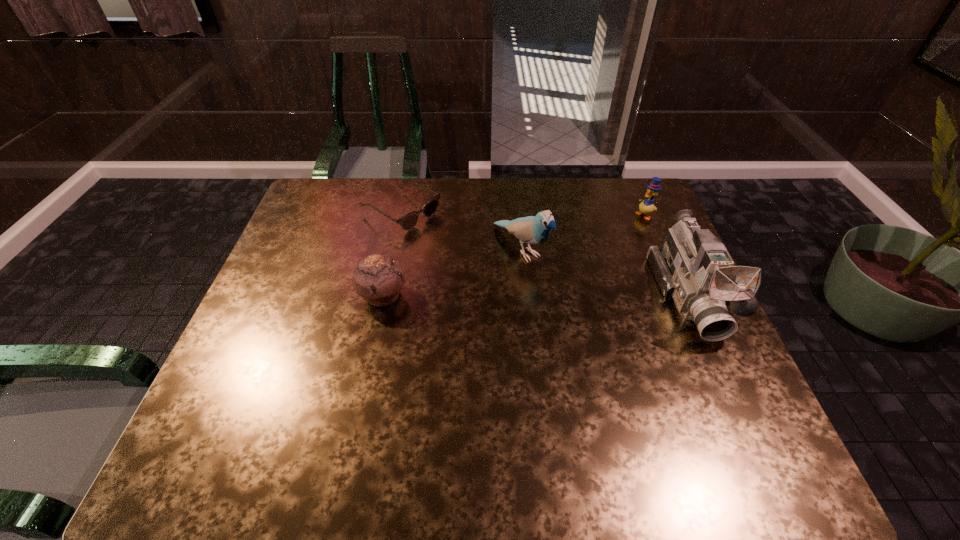
Identify the location of object present at the far right corner. (646, 206).

Image resolution: width=960 pixels, height=540 pixels. I want to click on free region at the far edge of the desktop, so click(417, 208).

Identify the location of vacant area at the near edge of the desktop. Image resolution: width=960 pixels, height=540 pixels. (318, 403).

Where is `free space at the left edge`? This screenshot has height=540, width=960. free space at the left edge is located at coordinates (306, 305).

This screenshot has height=540, width=960. I want to click on free space at the right edge of the desktop, so click(685, 340).

At what (x,y) coordinates should I click in order to perform the action: click on unoccupied position between the camcorder and the bird. Please return your answer as a coordinate pair (x, y). Image resolution: width=960 pixels, height=540 pixels. Looking at the image, I should click on (605, 272).

This screenshot has width=960, height=540. Identify the location of free space between the duckling and the muffin. (514, 255).

The image size is (960, 540). I want to click on vacant area that lies between the camcorder and the shortest object, so click(544, 253).

The image size is (960, 540). What are the coordinates of `free spot between the sunglasses and the bird` in the screenshot? It's located at (461, 230).

The height and width of the screenshot is (540, 960). I want to click on free space between the third object from right to left and the camcorder, so click(x=605, y=272).